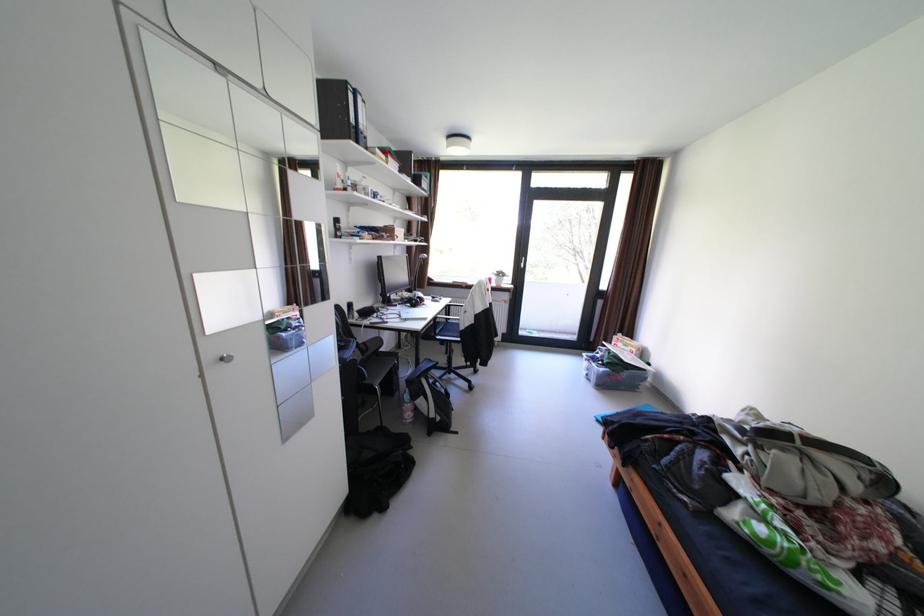
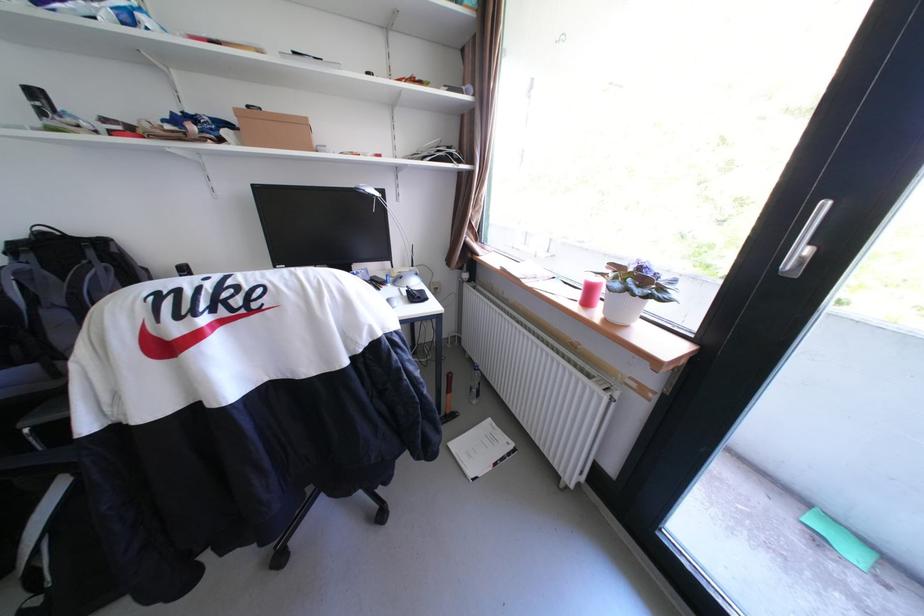
Where in the second image is the point corresponding to (x=532, y=265) from the first image?

(813, 253)